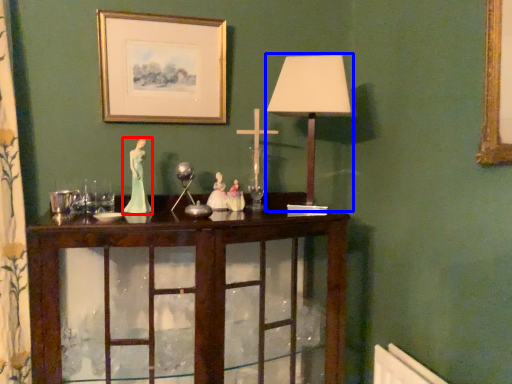
Question: Which point is closer to the camera, miniature (highlighted by a red box) or table lamp (highlighted by a blue box)?

Choices:
 (A) miniature
 (B) table lamp

Answer: (B)